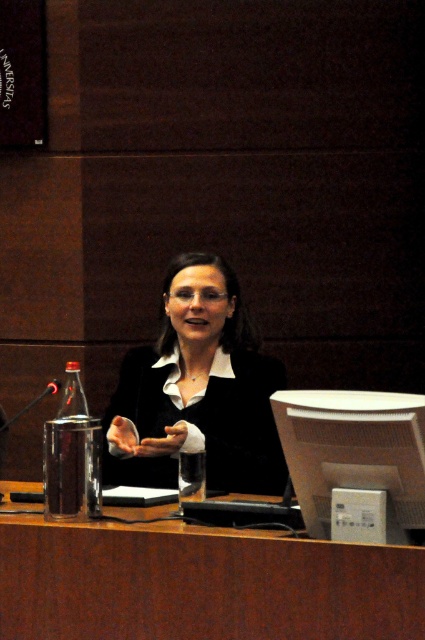
Question: Can you confirm if brown wood table at center is thinner than black glossy suit at center?

Choices:
 (A) no
 (B) yes

Answer: (A)

Question: Does brown wood table at center have a lesser width compared to black glossy suit at center?

Choices:
 (A) no
 (B) yes

Answer: (A)

Question: Is brown wood table at center behind black glossy suit at center?

Choices:
 (A) yes
 (B) no

Answer: (B)

Question: Which point is farther to the camera?

Choices:
 (A) black glossy suit at center
 (B) brown wood table at center

Answer: (A)

Question: Which point appears closest to the camera in this image?

Choices:
 (A) click(x=300, y=627)
 (B) click(x=203, y=259)

Answer: (A)